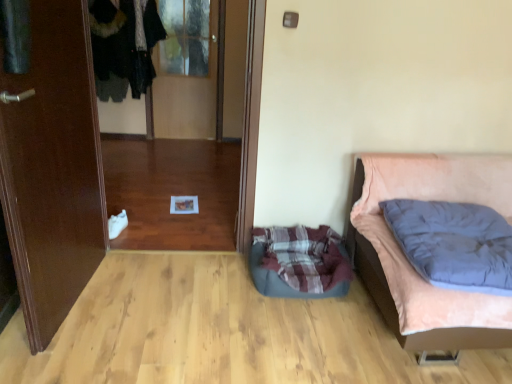
Where is `free point to the right of brown wooden door at left`? This screenshot has height=384, width=512. free point to the right of brown wooden door at left is located at coordinates (157, 302).